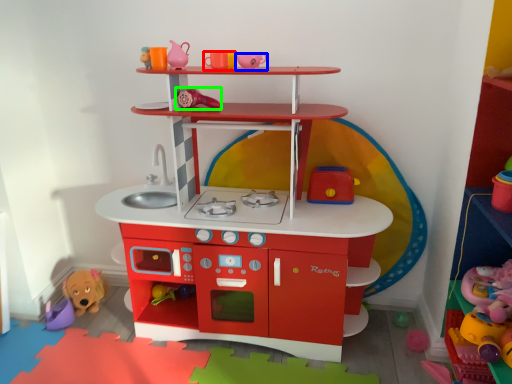
Question: Which is nearer to the toy (highlighted by a red box)? toy (highlighted by a blue box) or toy (highlighted by a green box).

Choices:
 (A) toy
 (B) toy

Answer: (A)